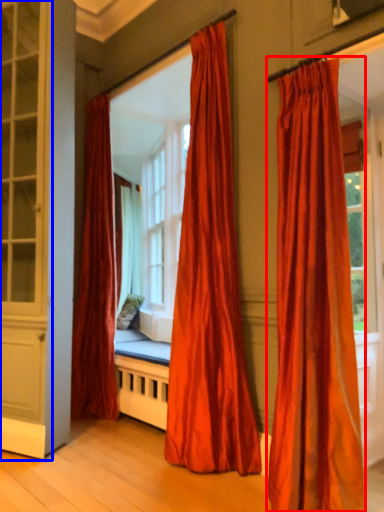
Question: Which of the following is the closest to the observer, curtain (highlighted by a red box) or screen door (highlighted by a blue box)?

Choices:
 (A) curtain
 (B) screen door

Answer: (A)